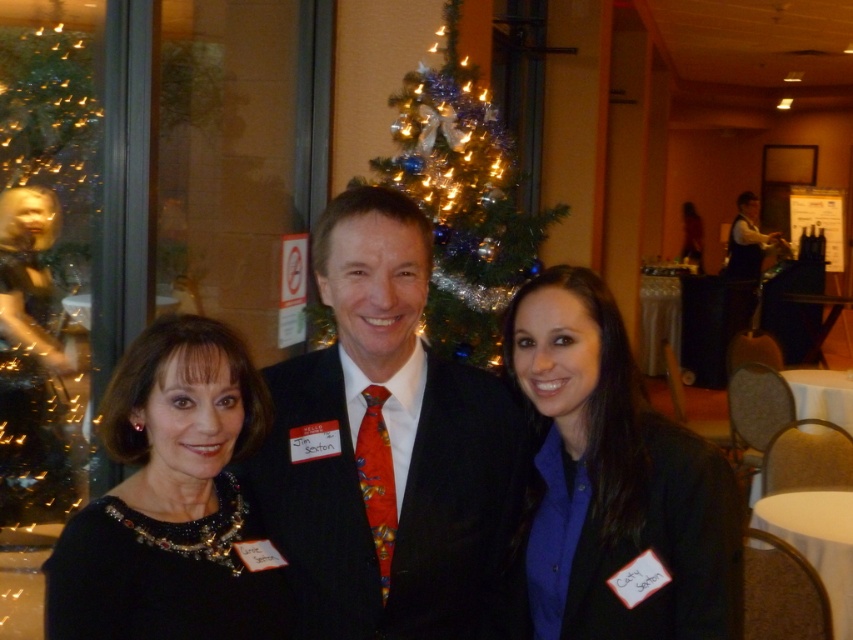
Question: Among these objects, which one is farthest from the camera?

Choices:
 (A) shiny gold statue at left
 (B) black sequined dress at center

Answer: (A)

Question: Which point is closer to the camera taking this photo?

Choices:
 (A) (111, 449)
 (B) (817, 292)
 (C) (498, 145)
 (D) (579, 452)

Answer: (A)

Question: Which of the following is the closest to the observer?

Choices:
 (A) (186, 570)
 (B) (821, 296)
 (C) (320, 579)

Answer: (A)

Question: Is the position of black sequined dress at center more distant than that of white cloth-covered table at lower right?

Choices:
 (A) no
 (B) yes

Answer: (A)

Question: Is matte black dress at center below black sequined dress at center?

Choices:
 (A) yes
 (B) no

Answer: (B)

Question: From the image, what is the correct spatial relationship of black matte jacket at center in relation to iridescent glass christmas tree at center?

Choices:
 (A) left
 (B) right

Answer: (B)